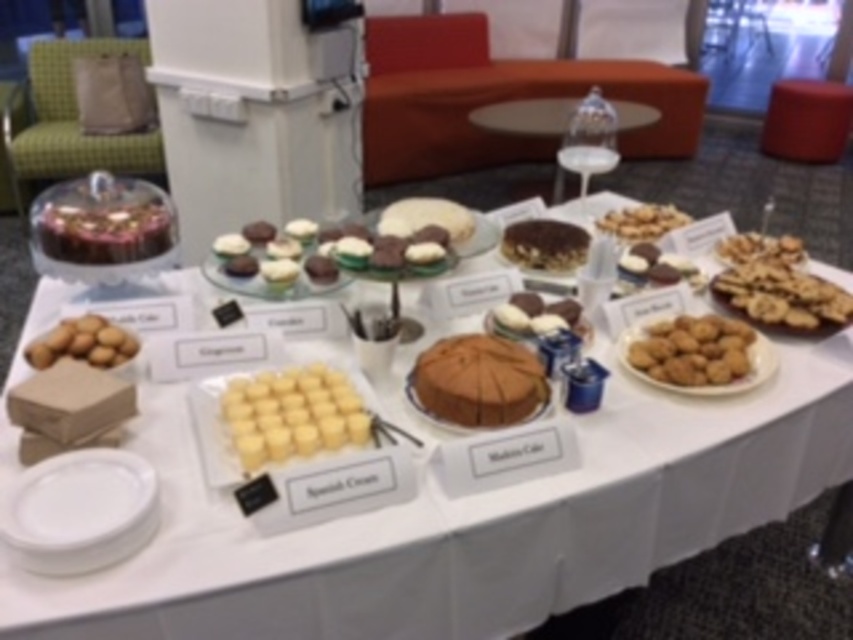
You are a guest at a dessert table and want to grab a plate to serve yourself. Where is the white matte plate at lower left located in terms of coordinates?

The white matte plate at lower left is located at coordinates point (80, 502).

You are a guest at the event and want to take a photo of the matte brown cake at center. If your camera has a minimum focus distance of 40 inches, will you need to move closer or farther away to take a clear photo?

The matte brown cake at center is currently 38.59 inches away from the camera. Since the minimum focus distance is 40 inches, you need to move farther away to ensure the camera can focus properly.

You are a guest at the event and want to take a cupcake from the white frosted cupcakes at center. However, there is a matte brown cake at center blocking your path. Can you reach the cupcakes without moving the cake?

The matte brown cake at center is in front of the white frosted cupcakes at center, so you cannot reach the cupcakes without moving the cake.